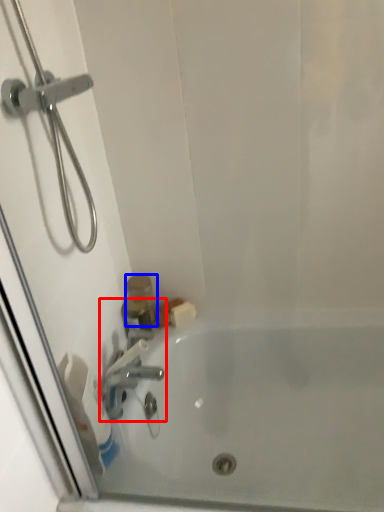
Question: Among these objects, which one is nearest to the camera, tap (highlighted by a red box) or toiletry (highlighted by a blue box)?

Choices:
 (A) tap
 (B) toiletry

Answer: (A)